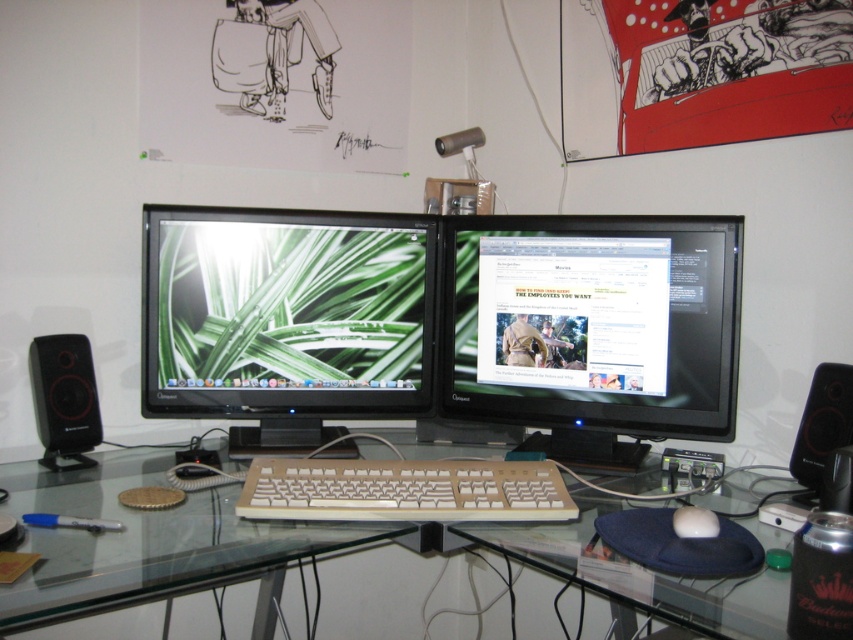
Question: Is the position of black matte speaker at left less distant than that of white matte mouse at lower center?

Choices:
 (A) yes
 (B) no

Answer: (B)

Question: In this image, where is green matte monitor at center located relative to black matte speaker at left?

Choices:
 (A) right
 (B) left

Answer: (A)

Question: Which of the following is the closest to the observer?

Choices:
 (A) tap(689, 525)
 (B) tap(426, 474)
 (C) tap(253, 528)
 (D) tap(682, 355)

Answer: (A)

Question: Which object is the farthest from the white matte mouse at lower center?

Choices:
 (A) green matte monitor at center
 (B) transparent glass desk at center
 (C) black matte speaker at left

Answer: (C)

Question: Is transparent glass desk at center behind black matte speaker at left?

Choices:
 (A) yes
 (B) no

Answer: (B)

Question: Considering the real-world distances, which object is farthest from the white matte mouse at lower center?

Choices:
 (A) white plastic keyboard at center
 (B) black plastic speaker at right
 (C) green matte monitor at center
 (D) black glossy monitor at center

Answer: (C)